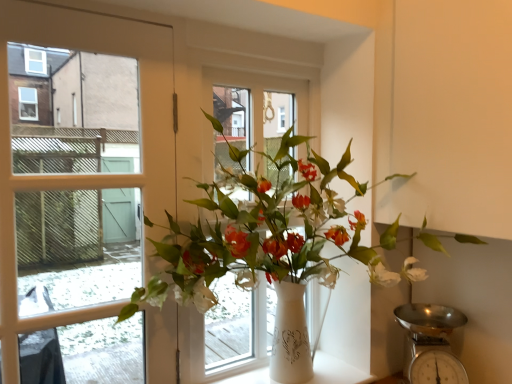
Question: In the image, is white ceramic vase at center on the left side or the right side of white glossy vase at center?

Choices:
 (A) right
 (B) left

Answer: (A)

Question: From their relative heights in the image, would you say white ceramic vase at center is taller or shorter than white glossy vase at center?

Choices:
 (A) tall
 (B) short

Answer: (B)

Question: Which of these objects is positioned farthest from the white glossy vase at center?

Choices:
 (A) white plastic window frame at center
 (B) metallic silver scale at lower right
 (C) white ceramic vase at center

Answer: (C)

Question: Considering the real-world distances, which object is farthest from the metallic silver scale at lower right?

Choices:
 (A) white plastic window frame at center
 (B) white glossy vase at center
 (C) white ceramic vase at center

Answer: (A)